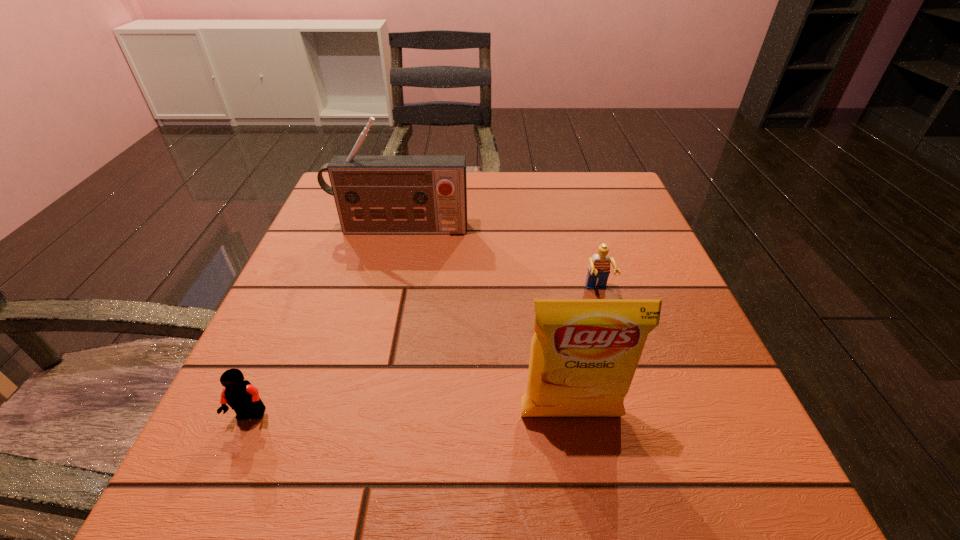
Point out which object is positioned as the second nearest to the crisp (potato chip). Please provide its 2D coordinates. Your answer should be formatted as a tuple, i.e. [(x, y)], where the tuple contains the x and y coordinates of a point satisfying the conditions above.

[(243, 397)]

Identify the location of the closest object to the right Lego. (584, 353).